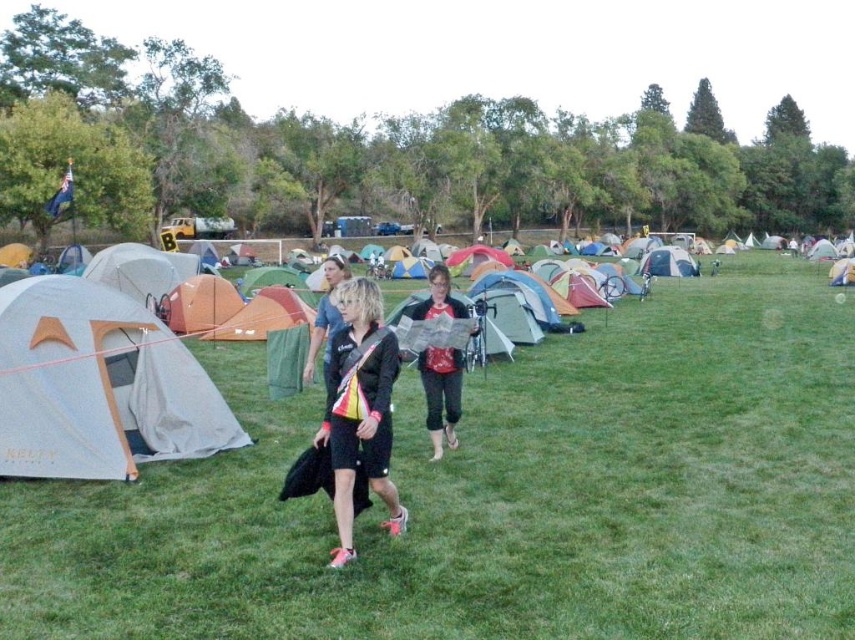
You are standing in the camping field and want to place a small picnic basket between the green grass at center and the red fabric map at center. Which object should you place it closer to if you want the basket to be more visible to people approaching from the front?

The green grass at center is closer to the viewer than the red fabric map at center, so placing the picnic basket closer to the green grass at center would make it more visible to people approaching from the front.

You are planning to set up a tent in the camping area. The green grass at center is where you want to place it. However, there are existing tents nearby. According to the scene description, what is the minimum distance you should maintain between your new tent and the nearest existing tent?

The minimum distance you should maintain between your new tent and the nearest existing tent is 15.32 feet, as the green grass at center is where you want to place it and they are 15.32 feet apart.

You are standing at the point with coordinates point (317, 312) and want to walk towards the tents in the background. There is a point (369, 403) in front of you. Which direction should you walk to reach the tents?

Since point (369, 403) is in front of point (317, 312), you should walk away from point (369, 403) towards the tents in the background.